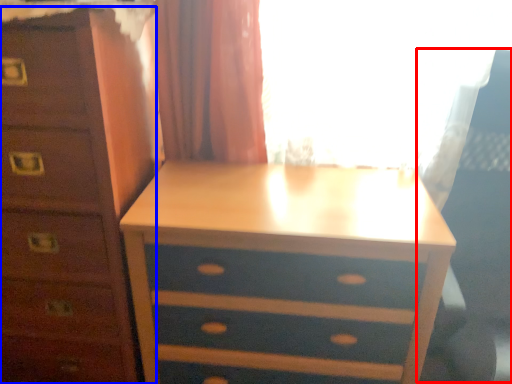
Question: Among these objects, which one is farthest to the camera, swivel chair (highlighted by a red box) or chest of drawers (highlighted by a blue box)?

Choices:
 (A) swivel chair
 (B) chest of drawers

Answer: (B)